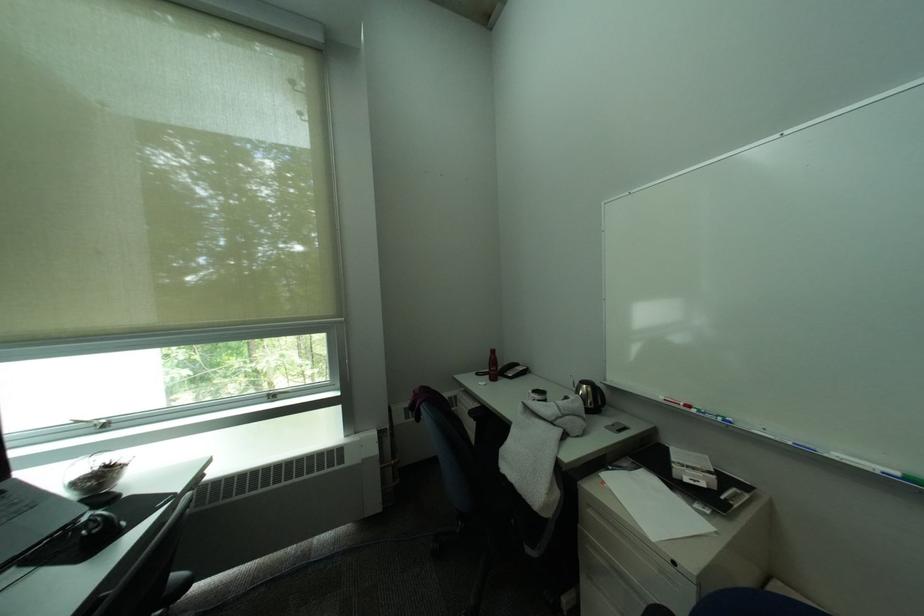
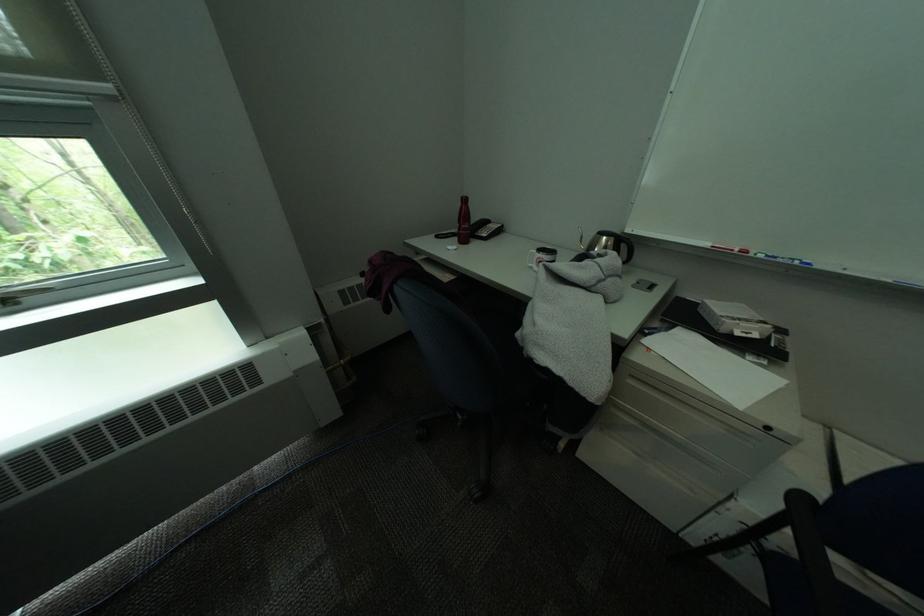
In the second image, find the point that corresponds to (x=624, y=427) in the first image.

(649, 284)